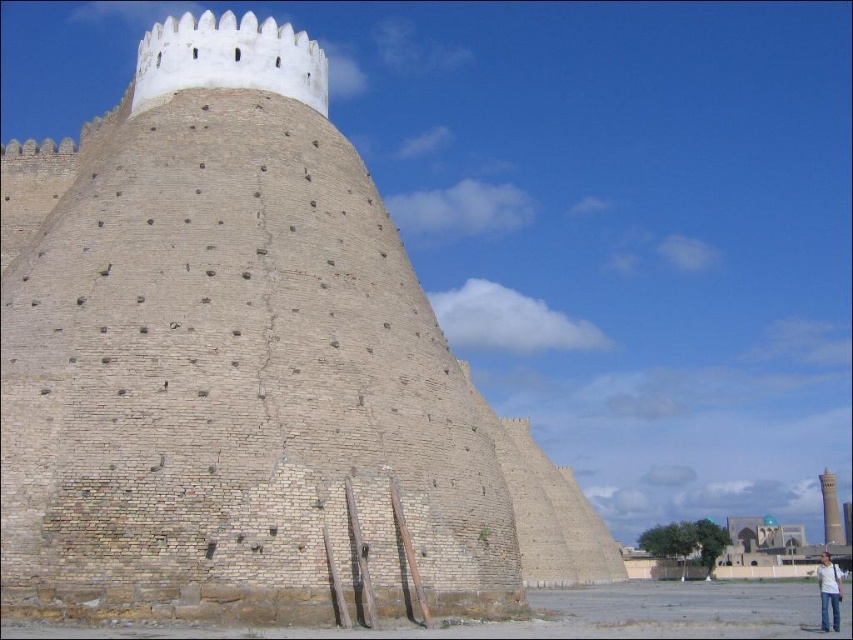
Find the location of a particular element. Image resolution: width=853 pixels, height=640 pixels. beige brick fort at center is located at coordinates (247, 371).

Who is positioned more to the left, beige brick fort at center or smooth beige tower at right?

beige brick fort at center is more to the left.

Between point (341, 416) and point (828, 480), which one is positioned in front?

Point (341, 416) is in front.

Identify the location of beige brick fort at center. (247, 371).